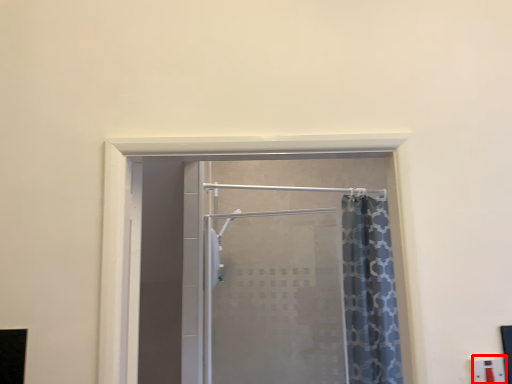
Question: Considering the relative positions of electric outlet (annotated by the red box) and door in the image provided, where is electric outlet (annotated by the red box) located with respect to the staircase?

Choices:
 (A) left
 (B) right

Answer: (B)